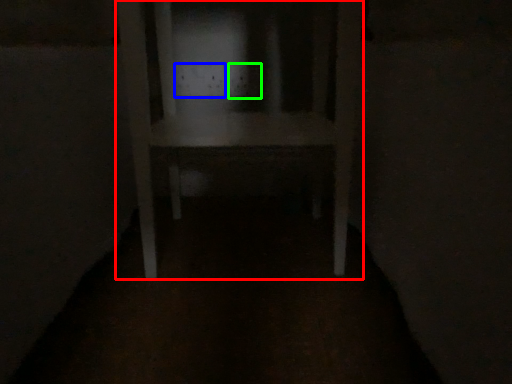
Question: Based on their relative distances, which object is nearer to furniture (highlighted by a red box)? Choose from electric outlet (highlighted by a blue box) and electric outlet (highlighted by a green box).

Choices:
 (A) electric outlet
 (B) electric outlet

Answer: (A)